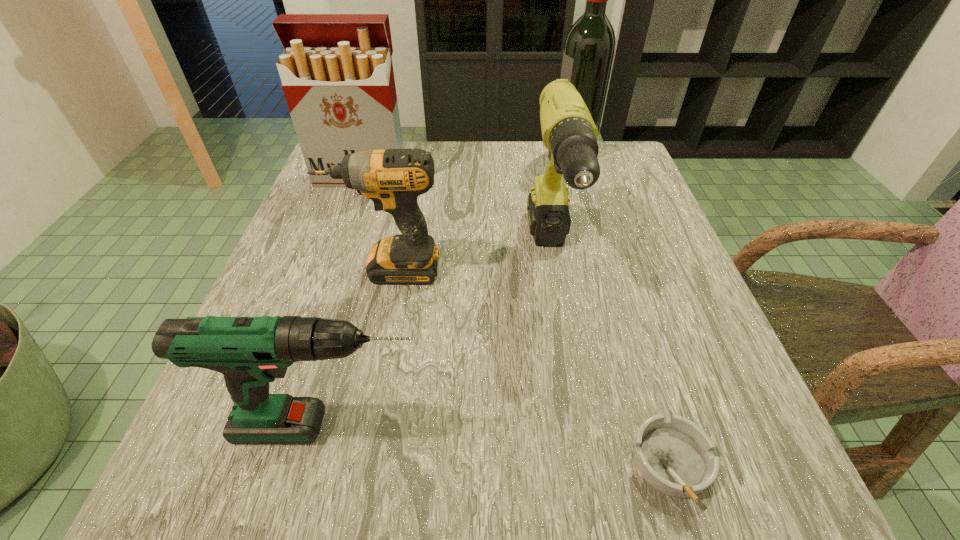
You are a GUI agent. You are given a task and a screenshot of the screen. Output one action in this format:
    pyautogui.click(x=<x>, y=<y>)
    Task: Click on the free space located 0.320m with the lid open on the cigarette case
    
    Given the screenshot: What is the action you would take?
    pyautogui.click(x=323, y=289)

At what (x,y) coordinates should I click in order to perform the action: click on vacant region located on the handle side of the fourth object from left to right. Please return your answer as a coordinate pair (x, y). This screenshot has height=540, width=960. Looking at the image, I should click on (587, 465).

The height and width of the screenshot is (540, 960). I want to click on vacant position located on the handle side of the nearest drill, so click(x=487, y=427).

This screenshot has width=960, height=540. Find the location of `vacant space located 0.310m on the left of the shortest object`. vacant space located 0.310m on the left of the shortest object is located at coordinates (391, 464).

Locate an element on the screen. The width and height of the screenshot is (960, 540). wine bottle that is at the far edge is located at coordinates (588, 54).

Locate an element on the screen. This screenshot has width=960, height=540. cigarette case that is at the far edge is located at coordinates (337, 76).

Image resolution: width=960 pixels, height=540 pixels. I want to click on drill at the near edge, so click(250, 352).

At what (x,y) coordinates should I click in order to perform the action: click on ashtray situated at the near edge. Please return your answer as a coordinate pair (x, y). Looking at the image, I should click on (674, 455).

Find the location of `cigarette case that is at the left edge`. cigarette case that is at the left edge is located at coordinates (337, 76).

Locate an element on the screen. wine bottle situated at the right edge is located at coordinates (588, 54).